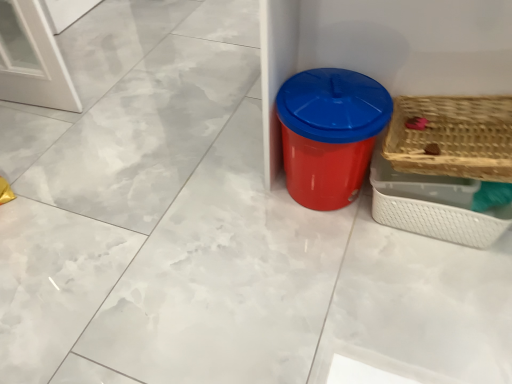
Question: From a real-world perspective, relative to woven wood basket at right, the 1th basket from the top, is woven wood basket at right, which appears as the 1th basket when ordered from the bottom, vertically above or below?

Choices:
 (A) below
 (B) above

Answer: (A)

Question: Would you say woven wood basket at right, which appears as the 1th basket when ordered from the bottom, is to the left or to the right of woven wood basket at right, the 2th basket in the bottom-to-top sequence, in the picture?

Choices:
 (A) left
 (B) right

Answer: (B)

Question: Considering the real-world distances, which object is closest to the red plastic bin at center?

Choices:
 (A) woven wood basket at right, which appears as the 1th basket when ordered from the bottom
 (B) woven wood basket at right, the 1th basket from the top

Answer: (A)

Question: Which of these objects is positioned farthest from the woven wood basket at right, the 1th basket from the top?

Choices:
 (A) red plastic bin at center
 (B) woven wood basket at right, placed as the second basket when sorted from top to bottom

Answer: (A)